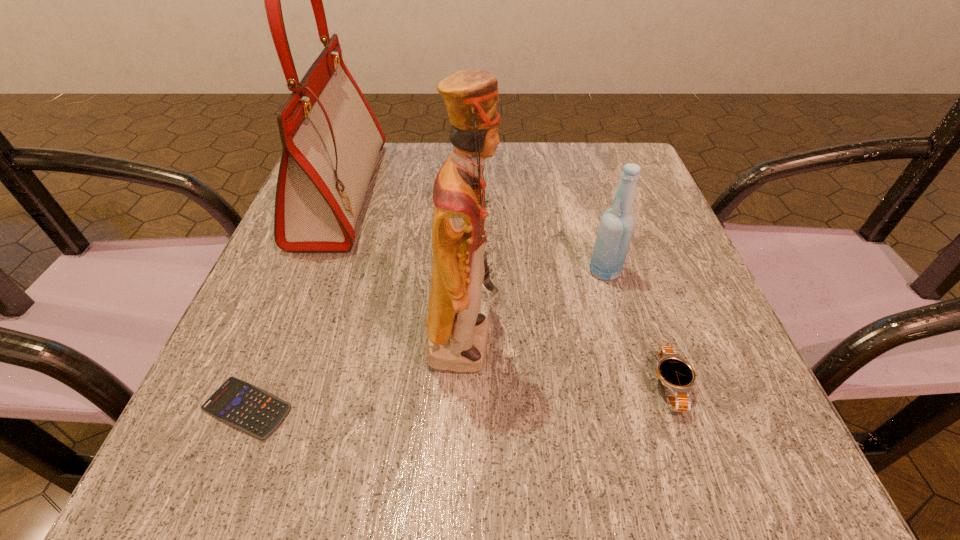
Where is `blank space located on the face of the compass`? blank space located on the face of the compass is located at coordinates (603, 206).

The image size is (960, 540). I want to click on vacant space located 0.350m on the back of the watch, so click(x=610, y=212).

The height and width of the screenshot is (540, 960). I want to click on vacant point located on the right of the shortest object, so click(420, 408).

The width and height of the screenshot is (960, 540). Identify the location of object that is at the far edge. (331, 139).

At what (x,y) coordinates should I click in order to perform the action: click on object present at the near edge. Please return your answer as a coordinate pair (x, y). Image resolution: width=960 pixels, height=540 pixels. Looking at the image, I should click on (248, 408).

Identify the location of handbag at the left edge. (331, 139).

In order to click on calculator located at the left edge in this screenshot , I will do `click(248, 408)`.

Identify the location of bottle positioned at the right edge. The image size is (960, 540). (617, 224).

Find the location of a particular element. watch that is at the right edge is located at coordinates (676, 374).

Identify the location of object at the far left corner. (331, 139).